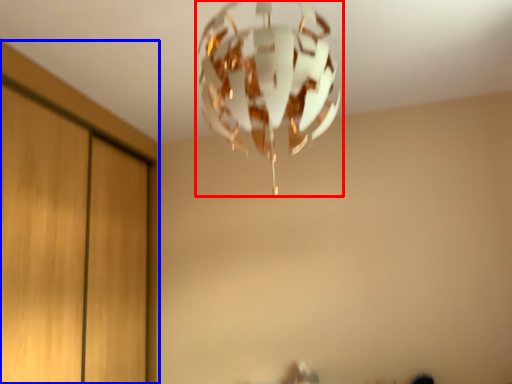
Question: Which point is closer to the camera, lamp (highlighted by a red box) or dresser (highlighted by a blue box)?

Choices:
 (A) lamp
 (B) dresser

Answer: (A)